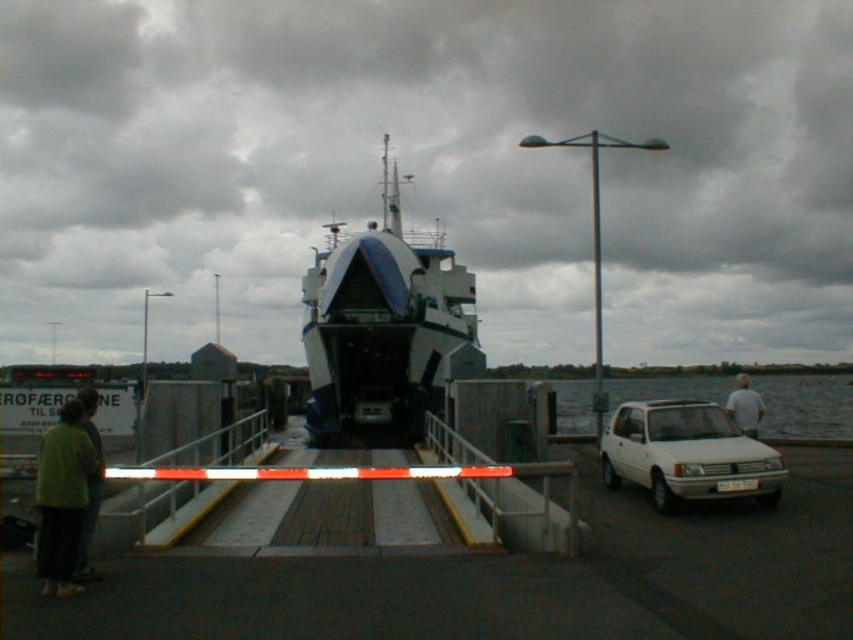
Question: Considering the real-world distances, which object is closest to the transparent water at car right?

Choices:
 (A) green fabric jacket at lower left
 (B) yellow-green shirt at left
 (C) blue matte boat at center
 (D) white matte car at lower right

Answer: (C)

Question: Can you confirm if blue matte boat at center is positioned to the right of transparent water at car right?

Choices:
 (A) no
 (B) yes

Answer: (A)

Question: Which point is closer to the camera?

Choices:
 (A) (657, 385)
 (B) (737, 384)
 (C) (387, 212)

Answer: (B)

Question: Does yellow-green shirt at left have a larger size compared to green fabric jacket at lower left?

Choices:
 (A) no
 (B) yes

Answer: (B)

Question: Is green fabric jacket at lower left closer to the viewer compared to white cotton shirt at right?

Choices:
 (A) yes
 (B) no

Answer: (A)

Question: Which point is closer to the camera?

Choices:
 (A) (737, 406)
 (B) (701, 388)

Answer: (A)